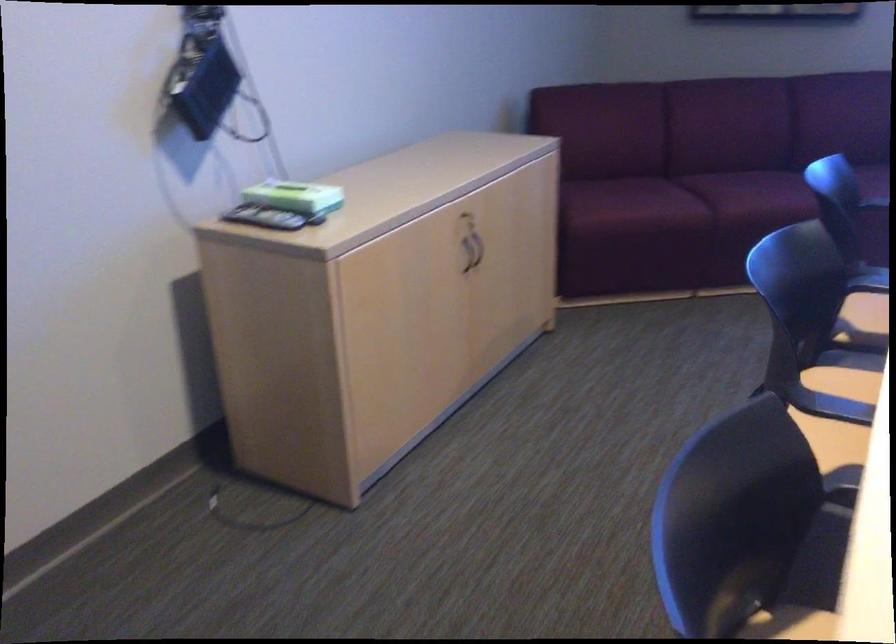
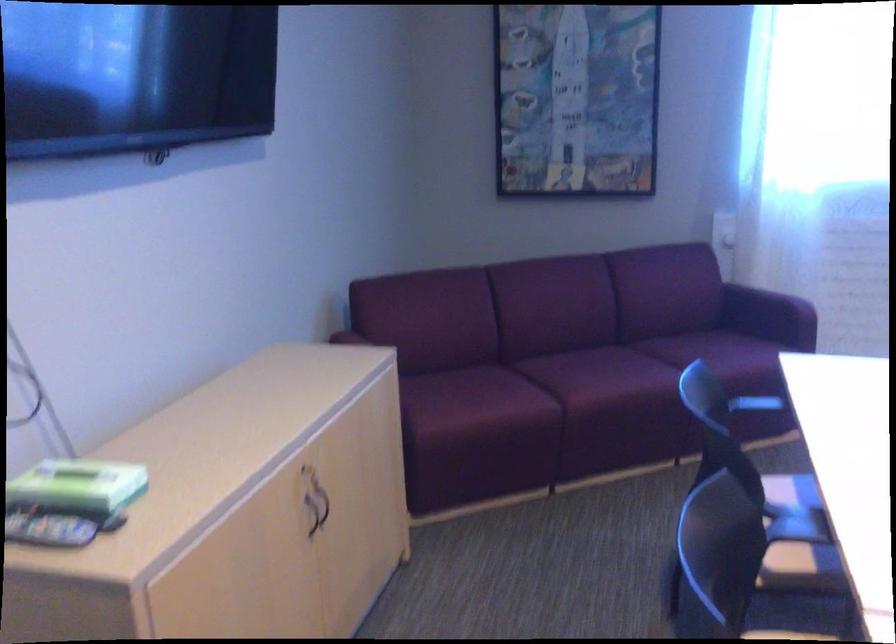
Question: The camera is either moving clockwise (left) or counter-clockwise (right) around the object. The first image is from the beginning of the video and the second image is from the end. Is the camera moving left or right when shooting the video?

Choices:
 (A) Left
 (B) Right

Answer: (A)